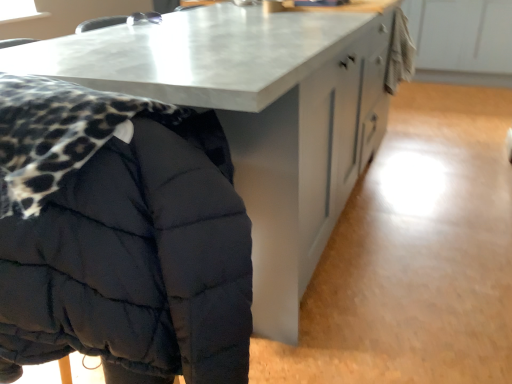
Question: From a real-world perspective, relative to matte gray table at center, is quilted black jacket at left vertically above or below?

Choices:
 (A) below
 (B) above

Answer: (B)

Question: Considering the positions of quilted black jacket at left and matte gray table at center in the image, is quilted black jacket at left taller or shorter than matte gray table at center?

Choices:
 (A) short
 (B) tall

Answer: (B)

Question: Would you say quilted black jacket at left is to the left or to the right of matte gray table at center in the picture?

Choices:
 (A) left
 (B) right

Answer: (A)

Question: Looking at their shapes, would you say matte gray table at center is wider or thinner than quilted black jacket at left?

Choices:
 (A) wide
 (B) thin

Answer: (A)

Question: Is matte gray table at center in front of or behind quilted black jacket at left in the image?

Choices:
 (A) behind
 (B) front

Answer: (A)

Question: From the image's perspective, relative to quilted black jacket at left, is matte gray table at center above or below?

Choices:
 (A) below
 (B) above

Answer: (B)

Question: Considering the positions of matte gray table at center and quilted black jacket at left in the image, is matte gray table at center taller or shorter than quilted black jacket at left?

Choices:
 (A) short
 (B) tall

Answer: (A)